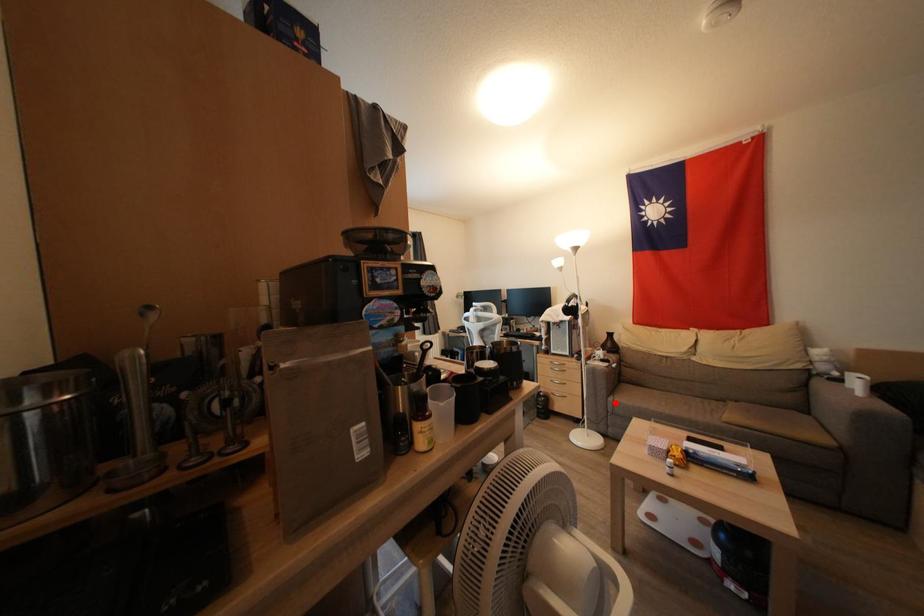
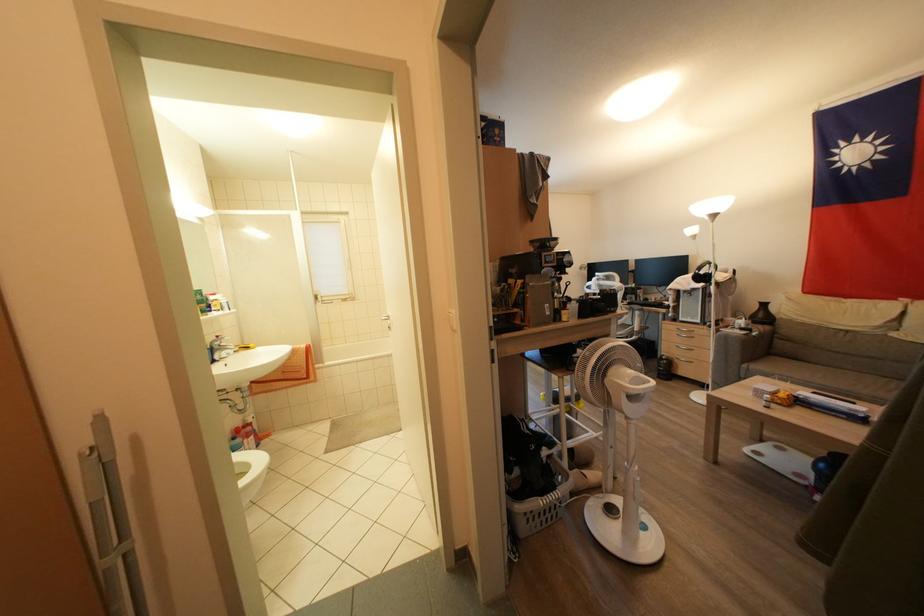
In the second image, find the point that corresponds to the highlighted location in the first image.

(748, 370)